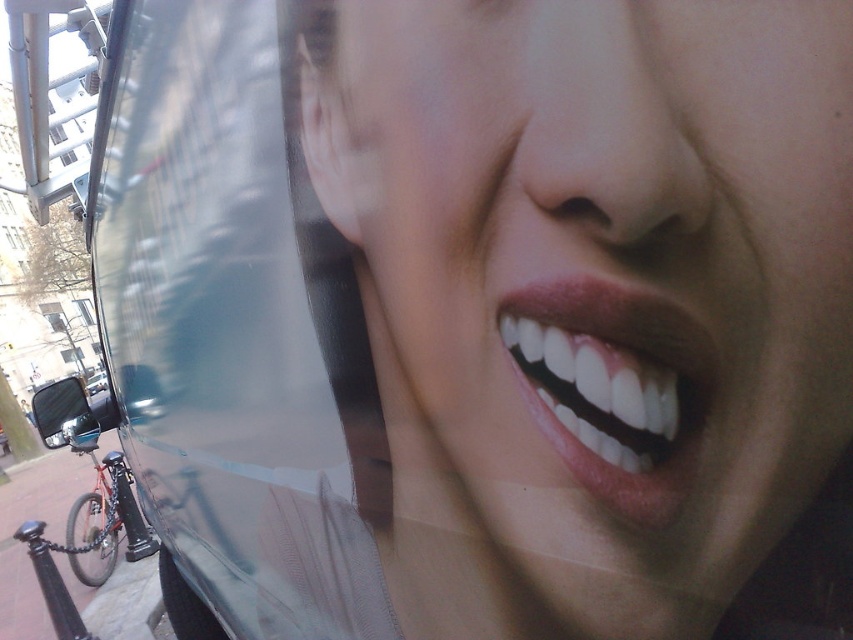
You are a photographer trying to capture a portrait of the matte skin face at center. There is a transparent glass bus window at upper left in the background. Considering the distance between them, can you fit both the face and the window in the frame without moving the camera?

The distance between the matte skin face at center and the transparent glass bus window at upper left is 18.92 inches. Since the photographer can adjust the camera zoom or angle to include both subjects within the frame, it is possible to capture both without moving the camera.

You are a delivery person with a 1.5 meter wide cart. You need to pass between the transparent glass bus window at upper left and the shiny metallic bicycle at lower left. Can your cart fit through the space between them?

The distance between the transparent glass bus window at upper left and the shiny metallic bicycle at lower left is 1.84 meters, so the cart which is 1.5 meters wide can fit through the space between them.

You are a photographer trying to capture a candid shot of the person smiling in the image. There is a transparent glass bus window at upper left that might reflect the scene behind. Based on its location at point (234, 332), would this window interfere with the shot of the person?

The transparent glass bus window at upper left is located at point (234, 332), which is in the upper left area of the image. Since the main focus is on the person smiling at the center, the window might cause a reflection or glare that could interfere with capturing a clear shot of the person.